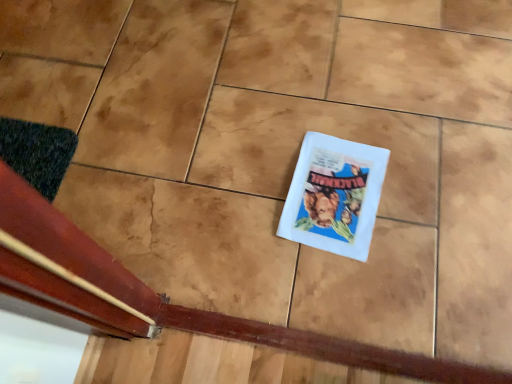
What is the approximate width of white paper at center?

white paper at center is 12.80 inches in width.

Describe the element at coordinates (334, 195) in the screenshot. I see `white paper at center` at that location.

At what (x,y) coordinates should I click in order to perform the action: click on white paper at center. Please return your answer as a coordinate pair (x, y). Looking at the image, I should click on (334, 195).

Where is `white paper at center`? The height and width of the screenshot is (384, 512). white paper at center is located at coordinates (334, 195).